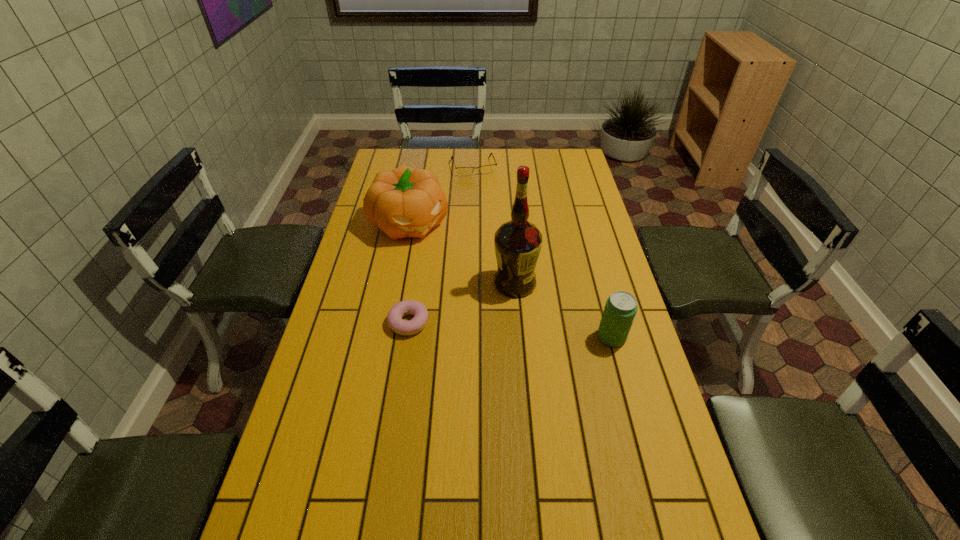
You are a GUI agent. You are given a task and a screenshot of the screen. Output one action in this format:
    pyautogui.click(x=<x>, y=<y>)
    Task: Click on the vacant space on the desktop that is between the doughnut and the soda and is positioned on the carved face of the second tallest object
    
    Given the screenshot: What is the action you would take?
    pyautogui.click(x=498, y=329)

Where is `vacant space on the desktop that is between the doughnut and the soda and is positioned on the front-facing side of the farthest object`? This screenshot has width=960, height=540. vacant space on the desktop that is between the doughnut and the soda and is positioned on the front-facing side of the farthest object is located at coordinates (528, 332).

The height and width of the screenshot is (540, 960). Find the location of `vacant spot on the desktop that is between the doughnut and the third tallest object and is positioned on the label of the tallest object`. vacant spot on the desktop that is between the doughnut and the third tallest object and is positioned on the label of the tallest object is located at coordinates (532, 332).